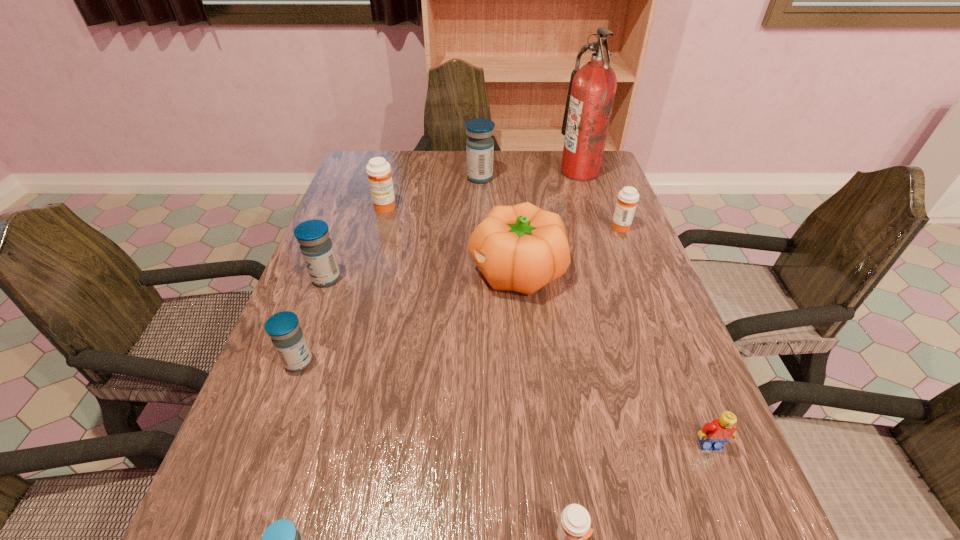
Identify the location of vacant space located on the carved face of the pumpkin. (316, 271).

Identify the location of free space located on the carved face of the pumpkin. (388, 271).

Find the location of `free space located on the front of the eighth nearest object`. free space located on the front of the eighth nearest object is located at coordinates (372, 255).

Locate an element on the screen. The height and width of the screenshot is (540, 960). vacant position located 0.090m on the right of the third smallest blue medicine is located at coordinates (378, 278).

You are a GUI agent. You are given a task and a screenshot of the screen. Output one action in this format:
    pyautogui.click(x=<x>, y=<y>)
    Task: Click on the free space located on the back of the rightmost medicine
    The height and width of the screenshot is (540, 960).
    Given the screenshot: What is the action you would take?
    pyautogui.click(x=592, y=154)

You are a GUI agent. You are given a task and a screenshot of the screen. Output one action in this format:
    pyautogui.click(x=<x>, y=<y>)
    Task: Click on the vacant space located 0.330m on the right of the second nearest blue medicine
    This screenshot has height=540, width=960.
    Given the screenshot: What is the action you would take?
    pyautogui.click(x=475, y=362)

The width and height of the screenshot is (960, 540). In order to click on free space located 0.070m on the face of the red Lego in this screenshot , I will do `click(730, 494)`.

Where is `fire extinguisher present at the far edge`? fire extinguisher present at the far edge is located at coordinates (592, 88).

Where is `medicine at the far edge`? This screenshot has height=540, width=960. medicine at the far edge is located at coordinates (479, 145).

Find the location of a particular element. This screenshot has width=960, height=540. fire extinguisher that is at the right edge is located at coordinates (592, 88).